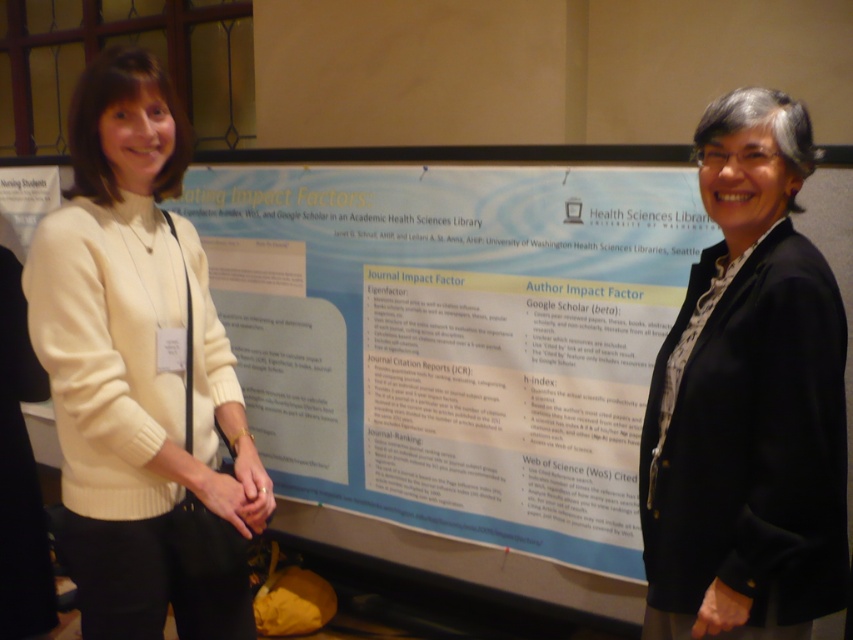
Question: Which point is farther to the camera?

Choices:
 (A) (178, 624)
 (B) (755, 609)

Answer: (A)

Question: Which of the following is the farthest from the observer?

Choices:
 (A) 751,481
 (B) 200,616

Answer: (B)

Question: Does creamy wool sweater at left appear on the right side of black textured blazer at right?

Choices:
 (A) yes
 (B) no

Answer: (B)

Question: Does creamy wool sweater at left have a greater width compared to black textured blazer at right?

Choices:
 (A) no
 (B) yes

Answer: (B)

Question: Does creamy wool sweater at left have a smaller size compared to black textured blazer at right?

Choices:
 (A) yes
 (B) no

Answer: (B)